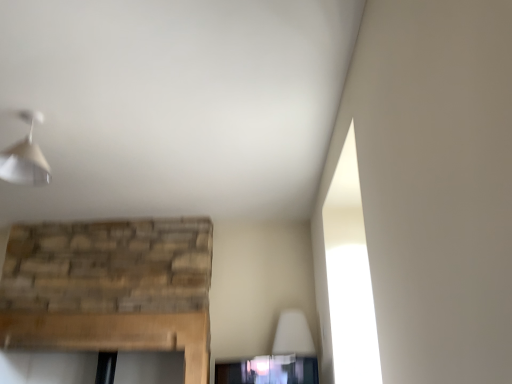
Describe the element at coordinates (25, 155) in the screenshot. Image resolution: width=512 pixels, height=384 pixels. I see `white matte lampshade at upper left` at that location.

Where is `white matte lampshade at upper left`? Image resolution: width=512 pixels, height=384 pixels. white matte lampshade at upper left is located at coordinates (25, 155).

Find the location of a particular element. The width and height of the screenshot is (512, 384). white matte lampshade at upper left is located at coordinates (25, 155).